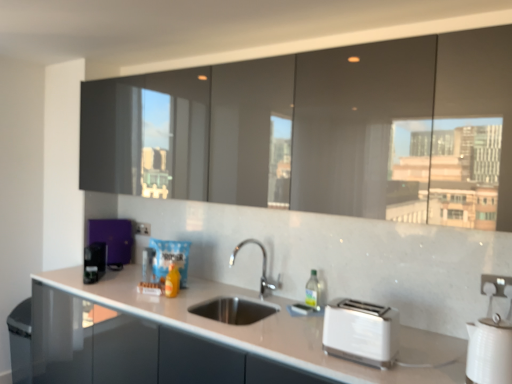
Where is `vacant space that is in between metallic silver toaster at center, arranged as the second appliance when viewed from the back, and black plastic coffee machine at left, which ranks as the 2th appliance in front-to-back order`? This screenshot has height=384, width=512. vacant space that is in between metallic silver toaster at center, arranged as the second appliance when viewed from the back, and black plastic coffee machine at left, which ranks as the 2th appliance in front-to-back order is located at coordinates (118, 279).